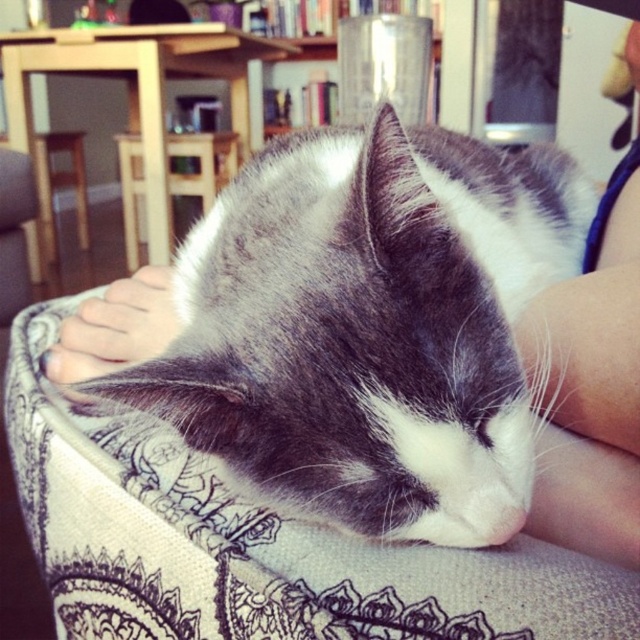
Between point (220, 540) and point (588, 483), which one is positioned in front?

Point (588, 483) is more forward.

Is patterned fabric couch at center positioned behind skinny white leg at lower right?

No, it is in front of skinny white leg at lower right.

Find the location of `patterned fabric couch at center`. patterned fabric couch at center is located at coordinates (252, 545).

Can you confirm if patterned fabric couch at center is bigger than metallic silver bookshelf at upper center?

No, patterned fabric couch at center is not bigger than metallic silver bookshelf at upper center.

Find the location of a particular element. patterned fabric couch at center is located at coordinates (252, 545).

Does point (472, 605) lie behind point (330, 4)?

No.

You are a GUI agent. You are given a task and a screenshot of the screen. Output one action in this format:
    pyautogui.click(x=<x>, y=<y>)
    Task: Click on the patterned fabric couch at center
    The width and height of the screenshot is (640, 640).
    Given the screenshot: What is the action you would take?
    pyautogui.click(x=252, y=545)

Does skinny white leg at lower right have a greater height compared to metallic silver bookshelf at upper center?

No.

Is skinny white leg at lower right smaller than metallic silver bookshelf at upper center?

Yes, skinny white leg at lower right is smaller than metallic silver bookshelf at upper center.

Locate an element on the screen. skinny white leg at lower right is located at coordinates (589, 387).

Identify the location of skinny white leg at lower right. This screenshot has width=640, height=640. (589, 387).